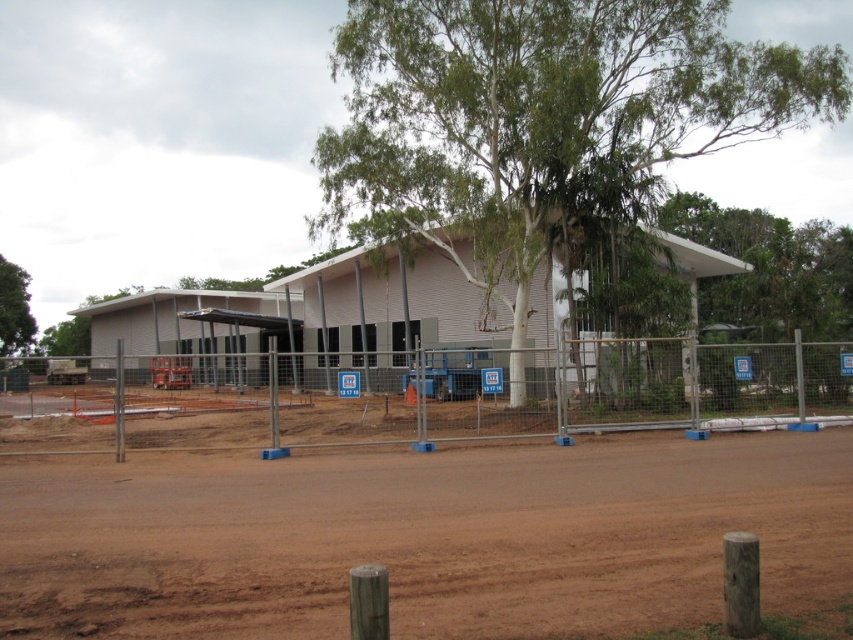
Does brown dirt track at lower center appear on the right side of green leafy tree at left?

Yes, brown dirt track at lower center is to the right of green leafy tree at left.

Is brown dirt track at lower center above green leafy tree at left?

No, brown dirt track at lower center is not above green leafy tree at left.

At what (x,y) coordinates should I click in order to perform the action: click on brown dirt track at lower center. Please return your answer as a coordinate pair (x, y). Looking at the image, I should click on (422, 538).

Does brown dirt track at lower center appear on the left side of green leafy tree at center?

Yes, brown dirt track at lower center is to the left of green leafy tree at center.

Does brown dirt track at lower center have a lesser height compared to green leafy tree at center?

Yes, brown dirt track at lower center is shorter than green leafy tree at center.

Image resolution: width=853 pixels, height=640 pixels. Identify the location of brown dirt track at lower center. (422, 538).

Can you confirm if green leafy tree at center is positioned to the left of metal mesh fence at center?

In fact, green leafy tree at center is to the right of metal mesh fence at center.

Which is below, green leafy tree at center or metal mesh fence at center?

metal mesh fence at center

The image size is (853, 640). Find the location of `green leafy tree at center`. green leafy tree at center is located at coordinates (540, 120).